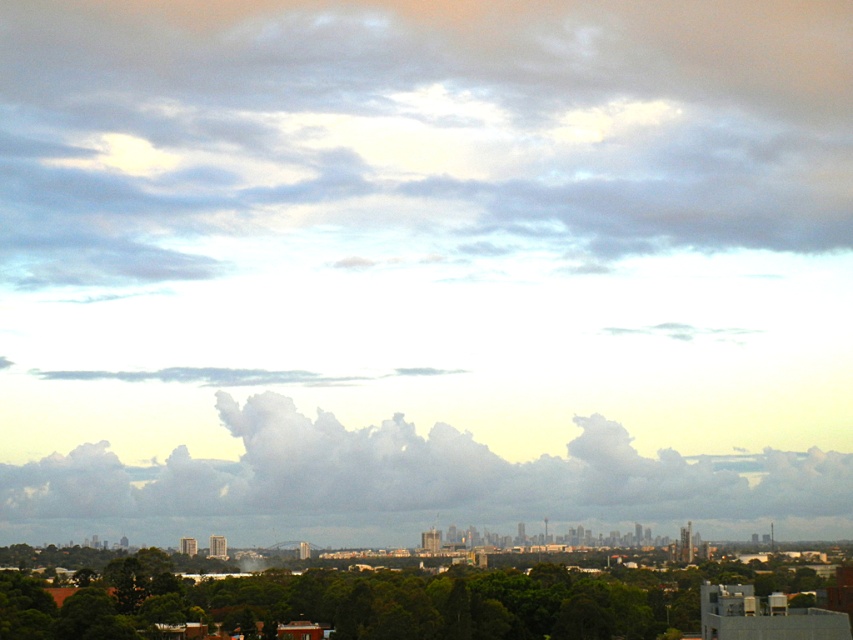
You are an architect designing a new building in the city. You want to ensure the building doesn not block the view of the cloudy sky at upper center and the white fluffy cloud at center from the park below. Which object should you consider the size of when planning the building height?

You should consider the size of the cloudy sky at upper center because its width is larger than the white fluffy cloud at center, meaning it requires more space to maintain an unobstructed view.

You are a drone operator who needs to fly a drone from the cloudy sky at upper center to the white fluffy cloud at center. What is the approximate distance you need to cover?

The distance between the cloudy sky at upper center and the white fluffy cloud at center is 302.39 feet, so the drone operator needs to cover approximately 302.39 feet.

You are an architect designing a new building in the city. You want to ensure the building will not block the view of the white fluffy cloud at center from the green leafy tree at lower center. Based on the scene, can you confirm if the tree currently has an unobstructed view of the cloud?

The white fluffy cloud at center is closer to the viewer than the green leafy tree at lower center, so the tree cannot see the cloud because the cloud is in front of it.